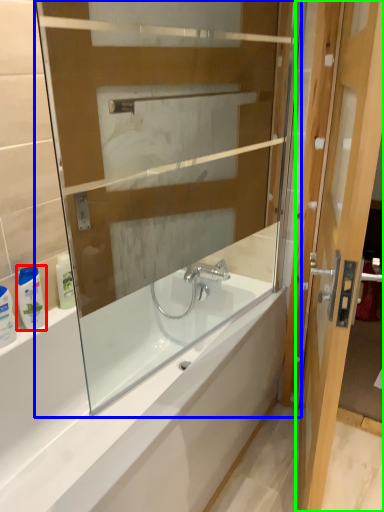
Question: Based on their relative distances, which object is nearer to toiletry (highlighted by a red box)? Choose from glass box (highlighted by a blue box) and door (highlighted by a green box).

Choices:
 (A) glass box
 (B) door

Answer: (A)